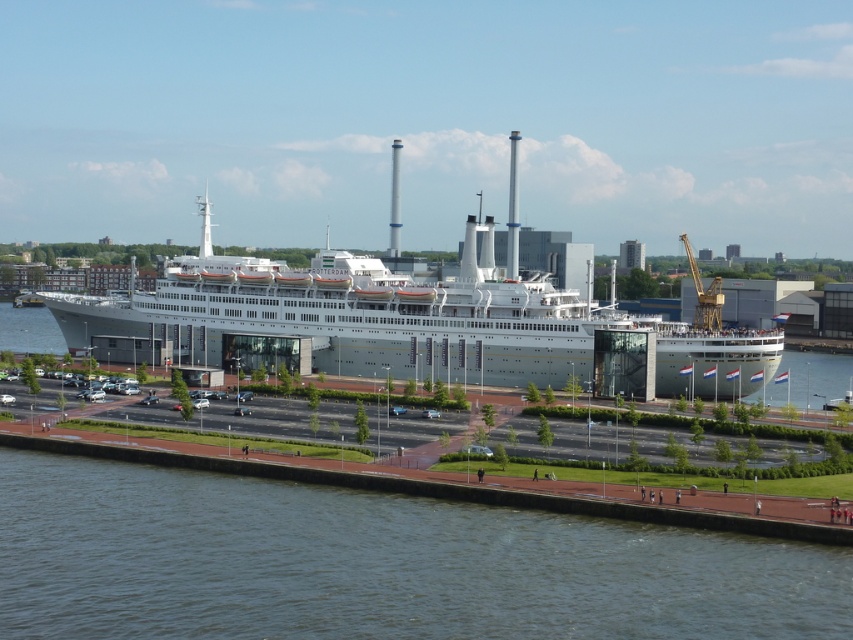
You are standing on the grassy area with trees and want to take a photo of the cruise ship. You have two options for where to stand to get the best shot. The first option is at point (238, 522) and the second option is at point (216, 320). Which point will make the cruise ship appear larger in your photo?

Point (238, 522) is closer to the camera than point (216, 320), so standing at point (238, 522) will make the cruise ship appear larger in your photo.

You are standing on the grassy area with trees and looking towards the waterfront. Which object takes up more space in the image between the dark blue water at lower center and the silver metallic cruise ship at center?

The silver metallic cruise ship at center occupies more space in the image than the dark blue water at lower center.

You are a photographer standing on the grassy area with trees. You want to take a photo of the silver metallic cruise ship at center and the dark blue water at lower center. Which object will appear narrower in your photo?

The dark blue water at lower center will appear narrower in the photo because it is thinner than the silver metallic cruise ship at center.